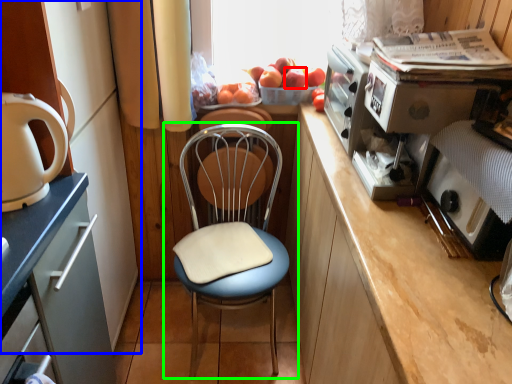
Question: Considering the real-world distances, which object is closest to apple (highlighted by a red box)? cabinetry (highlighted by a blue box) or chair (highlighted by a green box).

Choices:
 (A) cabinetry
 (B) chair

Answer: (B)